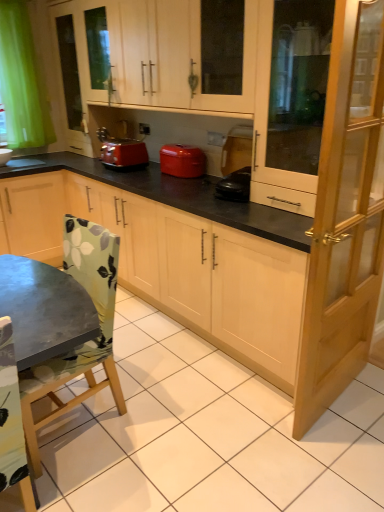
Question: Considering the relative positions of matte wood cabinet at center, which appears as the second cabinetry when viewed from the top, and matte red toaster at center in the image provided, is matte wood cabinet at center, which appears as the second cabinetry when viewed from the top, in front of matte red toaster at center?

Choices:
 (A) no
 (B) yes

Answer: (B)

Question: From a real-world perspective, is matte wood cabinet at center, the 1th cabinetry in the bottom-to-top sequence, on matte red toaster at center?

Choices:
 (A) yes
 (B) no

Answer: (B)

Question: From a real-world perspective, is matte wood cabinet at center, the 1th cabinetry in the bottom-to-top sequence, positioned under matte red toaster at center based on gravity?

Choices:
 (A) no
 (B) yes

Answer: (B)

Question: Can you confirm if matte wood cabinet at center, which appears as the second cabinetry when viewed from the top, is positioned to the left of matte red toaster at center?

Choices:
 (A) yes
 (B) no

Answer: (A)

Question: Is matte wood cabinet at center, the 1th cabinetry in the bottom-to-top sequence, not close to matte red toaster at center?

Choices:
 (A) no
 (B) yes

Answer: (A)

Question: Can you confirm if matte wood cabinet at center, the 1th cabinetry in the bottom-to-top sequence, is smaller than matte red toaster at center?

Choices:
 (A) yes
 (B) no

Answer: (B)

Question: Is the position of white glossy sink at lower left more distant than that of matte red toaster at center?

Choices:
 (A) no
 (B) yes

Answer: (B)

Question: From a real-world perspective, is white glossy sink at lower left beneath matte red toaster at center?

Choices:
 (A) no
 (B) yes

Answer: (B)

Question: Is white glossy sink at lower left facing towards matte red toaster at center?

Choices:
 (A) no
 (B) yes

Answer: (A)

Question: From the image's perspective, does white glossy sink at lower left appear higher than matte red toaster at center?

Choices:
 (A) yes
 (B) no

Answer: (A)

Question: Can you confirm if white glossy sink at lower left is thinner than matte red toaster at center?

Choices:
 (A) yes
 (B) no

Answer: (A)

Question: From a real-world perspective, is white glossy sink at lower left on matte red toaster at center?

Choices:
 (A) no
 (B) yes

Answer: (A)

Question: Is matte wood cabinet at upper center, which ranks as the 2th cabinetry in bottom-to-top order, aimed at transparent glass cabinet at right, which is counted as the 2th screen door, starting from the bottom?

Choices:
 (A) yes
 (B) no

Answer: (B)